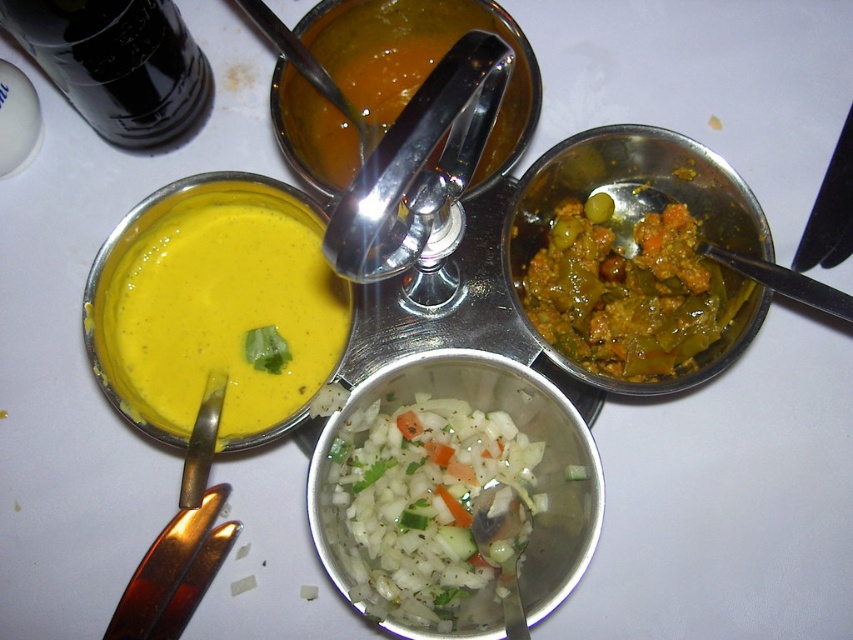
You are a drone operator trying to deliver a small package to a point on the metal serving tray. The tray has two points marked as point1 and point2. The coordinates for point1 are at (587,291) and point2 at (276,104). Which point is closer to the edge of the tray?

Point2 at (276,104) is closer to the edge of the tray because it has a smaller coordinate value in both x and y directions compared to point1.

You are at a buffet and want to grab both the green matte curry at upper right and the orange smoothie at center. Which one should you pick up first if you want to reach the one closer to you?

The orange smoothie at center is closer to you than the green matte curry at upper right, so you should pick up the orange smoothie at center first.

You are a food critic evaluating this meal. You need to describe the size comparison between the green matte curry at upper right and the green cucumber at center. Which one is larger?

The green matte curry at upper right is bigger than the green cucumber at center.